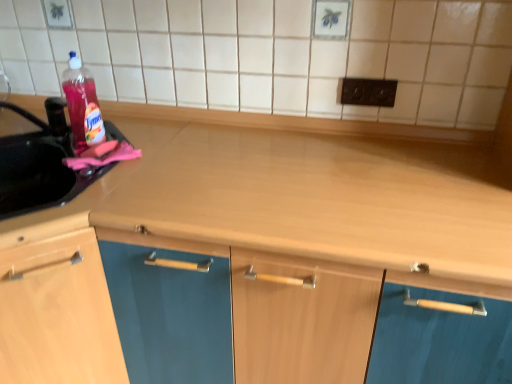
Identify the location of vacant space positioned to the left of translucent plastic bottle at left. This screenshot has height=384, width=512. (53, 148).